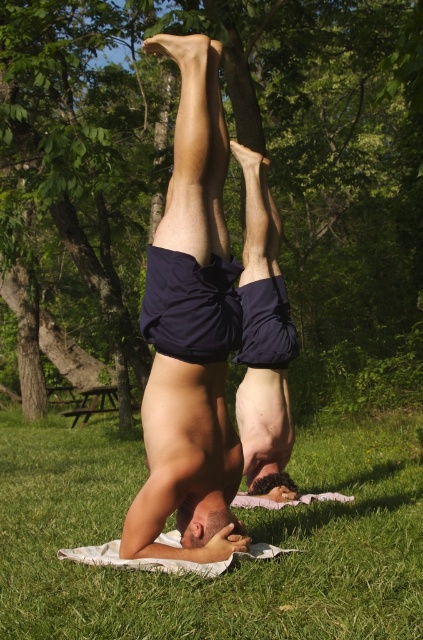
You are a photographer planning to take a photo of the green leafy tree at upper center and the matte blue shorts at center. Which object will appear larger in the photo?

The green leafy tree at upper center will appear larger in the photo because it is much taller than the matte blue shorts at center.

You are a photographer trying to capture a photo of the green grass at lower center without the green leafy tree at upper center blocking the view. Is it possible to do so by moving closer to the grass?

The green leafy tree at upper center is further to the viewer than the green grass at lower center, so moving closer to the grass would bring it nearer while the tree remains closer, making it harder to avoid the tree blocking the view. Therefore, it might not be possible to capture the grass without the tree blocking the view by moving closer.